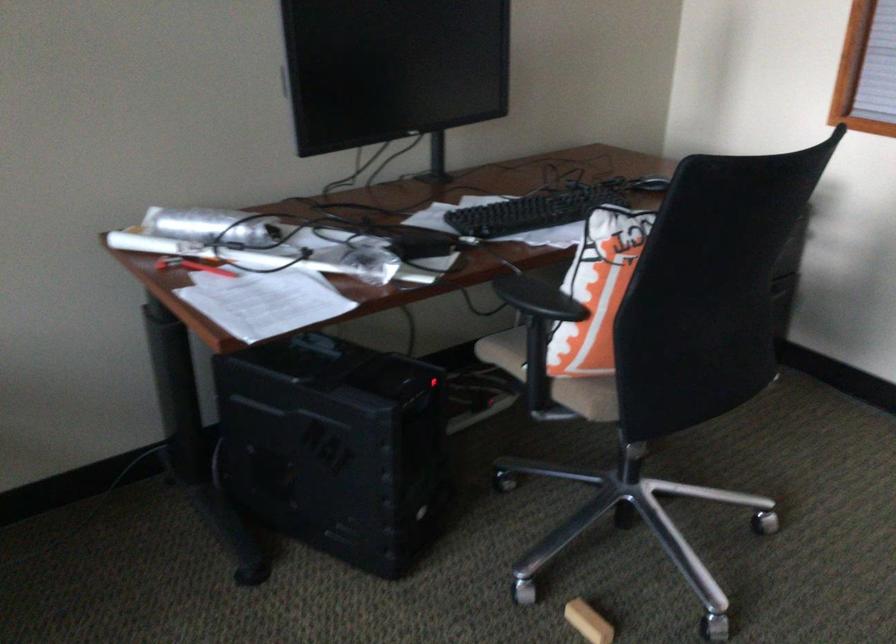
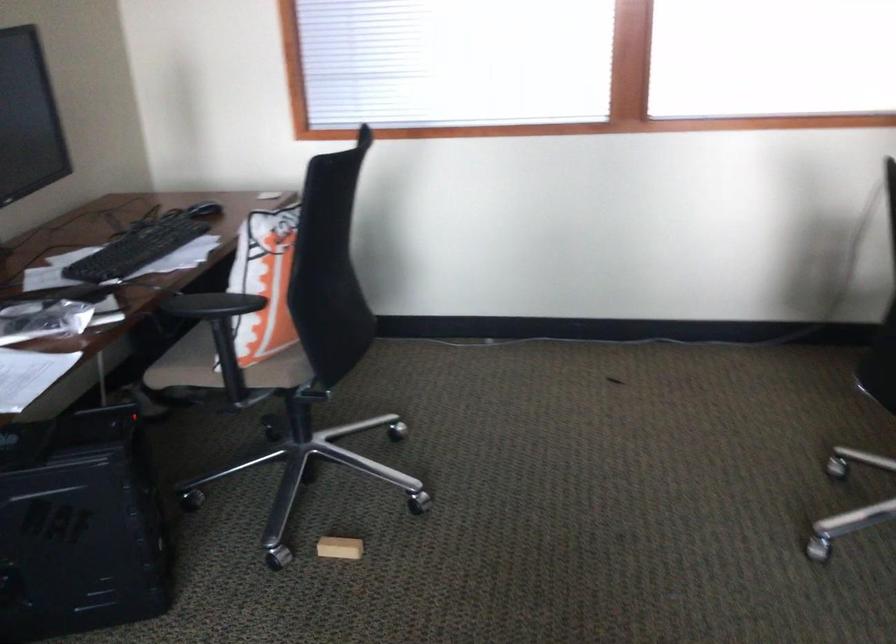
Question: Based on the continuous images, in which direction is the camera rotating? Reply with the corresponding letter.

Choices:
 (A) Left
 (B) Right
 (C) Up
 (D) Down

Answer: (B)